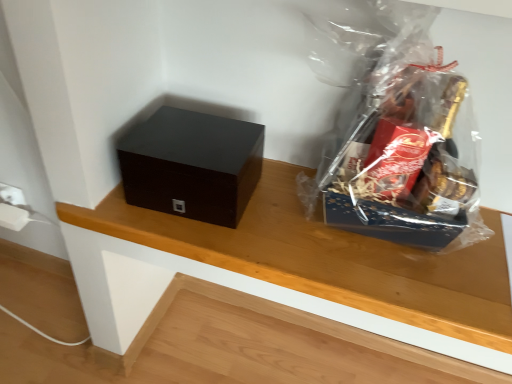
Question: Does transparent plastic gift basket at upper right have a greater width compared to wooden table at center?

Choices:
 (A) no
 (B) yes

Answer: (B)

Question: Is transparent plastic gift basket at upper right oriented away from wooden table at center?

Choices:
 (A) no
 (B) yes

Answer: (A)

Question: From a real-world perspective, is transparent plastic gift basket at upper right located beneath wooden table at center?

Choices:
 (A) yes
 (B) no

Answer: (B)

Question: Is transparent plastic gift basket at upper right far from wooden table at center?

Choices:
 (A) no
 (B) yes

Answer: (A)

Question: Is transparent plastic gift basket at upper right surrounding wooden table at center?

Choices:
 (A) yes
 (B) no

Answer: (B)

Question: Is transparent plastic gift basket at upper right further to camera compared to wooden table at center?

Choices:
 (A) no
 (B) yes

Answer: (A)

Question: From a real-world perspective, is matte black box at left located higher than wooden table at center?

Choices:
 (A) no
 (B) yes

Answer: (B)

Question: Does matte black box at left have a lesser width compared to wooden table at center?

Choices:
 (A) yes
 (B) no

Answer: (B)

Question: From a real-world perspective, is matte black box at left under wooden table at center?

Choices:
 (A) yes
 (B) no

Answer: (B)

Question: Is matte black box at left oriented away from wooden table at center?

Choices:
 (A) no
 (B) yes

Answer: (A)

Question: Does matte black box at left appear on the right side of wooden table at center?

Choices:
 (A) no
 (B) yes

Answer: (B)

Question: Is matte black box at left aimed at wooden table at center?

Choices:
 (A) yes
 (B) no

Answer: (B)

Question: Is transparent plastic gift basket at upper right completely or partially outside of matte black box at left?

Choices:
 (A) no
 (B) yes

Answer: (B)